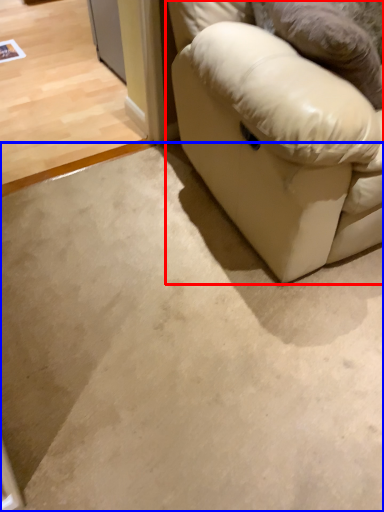
Question: Which object appears farthest to the camera in this image, studio couch (highlighted by a red box) or concrete (highlighted by a blue box)?

Choices:
 (A) studio couch
 (B) concrete

Answer: (B)